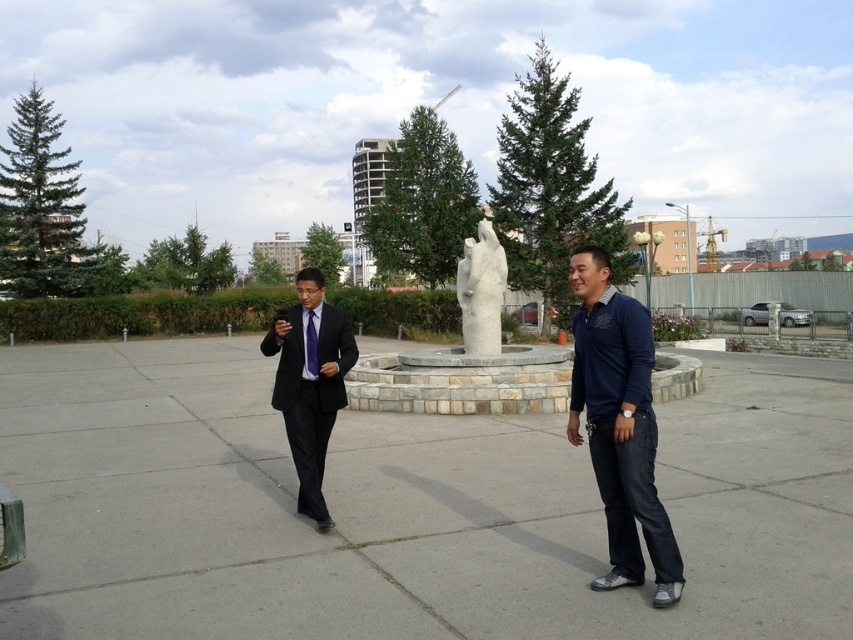
Between black suit at center and white marble statue at center, which one appears on the left side from the viewer's perspective?

From the viewer's perspective, black suit at center appears more on the left side.

Is black suit at center bigger than white marble statue at center?

Correct, black suit at center is larger in size than white marble statue at center.

At what (x,y) coordinates should I click in order to perform the action: click on black suit at center. Please return your answer as a coordinate pair (x, y). The image size is (853, 640). Looking at the image, I should click on (310, 385).

Which is above, black suit at center or purple silk tie at center?

purple silk tie at center is higher up.

The width and height of the screenshot is (853, 640). Identify the location of black suit at center. (310, 385).

Where is `black suit at center`? The image size is (853, 640). black suit at center is located at coordinates (310, 385).

This screenshot has height=640, width=853. Identify the location of black suit at center. (310, 385).

Which is in front, point (614, 332) or point (300, 276)?

Point (614, 332)

Is point (605, 276) farther from camera compared to point (286, 321)?

No, (605, 276) is closer to viewer.

Where is `dark blue denim jeans at center`? The image size is (853, 640). dark blue denim jeans at center is located at coordinates (619, 426).